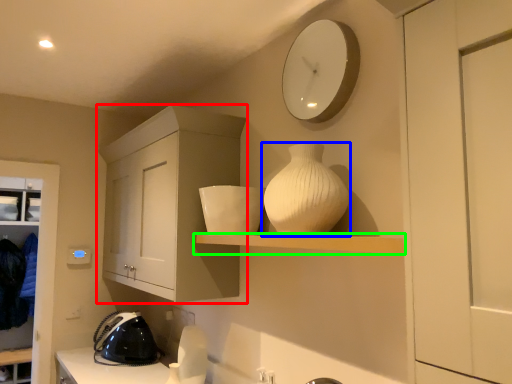
Question: Which object is positioned farthest from cabinetry (highlighted by a red box)? Select from vase (highlighted by a blue box) and shelf (highlighted by a green box).

Choices:
 (A) vase
 (B) shelf

Answer: (A)